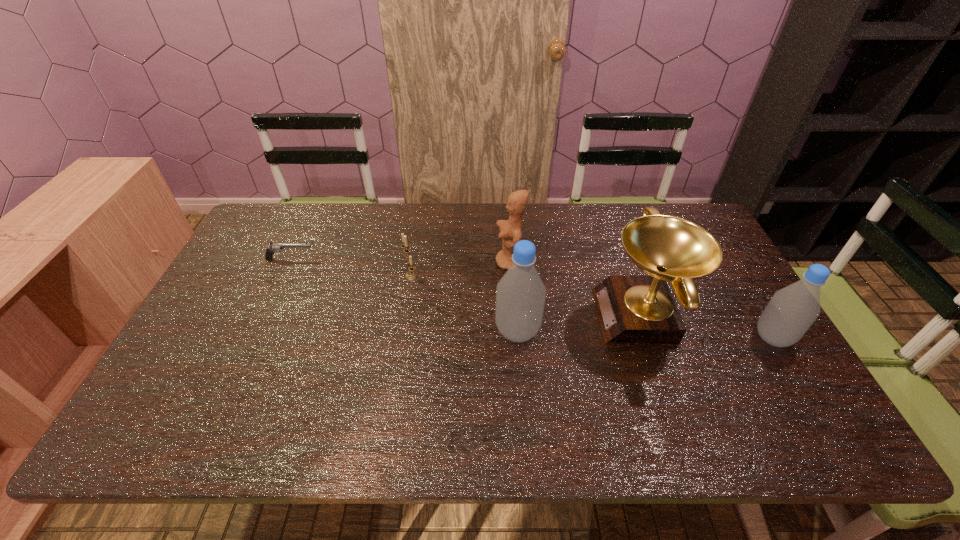
Identify the location of the left bottle. Image resolution: width=960 pixels, height=540 pixels. (520, 294).

At what (x,y) coordinates should I click in order to perform the action: click on the shorter bottle. Please return your answer as a coordinate pair (x, y). Looking at the image, I should click on pos(792,310).

Identify the location of the right bottle. The image size is (960, 540). (792, 310).

Locate an element on the screen. The height and width of the screenshot is (540, 960). candle is located at coordinates tap(410, 275).

Image resolution: width=960 pixels, height=540 pixels. I want to click on the second shortest object, so click(410, 275).

Where is `figurine`? figurine is located at coordinates (510, 230).

This screenshot has width=960, height=540. Identify the location of the shortest object. (274, 247).

The height and width of the screenshot is (540, 960). In order to click on the leftmost object in this screenshot , I will do `click(274, 247)`.

Locate an element on the screen. award is located at coordinates (632, 309).

Find the location of a particular element. blank space located 0.050m on the left of the taller bottle is located at coordinates (476, 331).